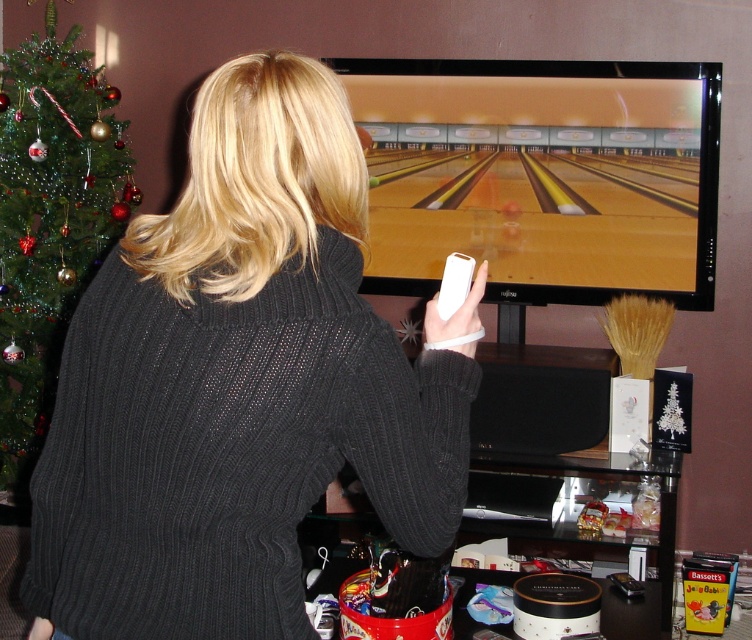
Question: Does black ribbed sweater at center appear over green textured christmas tree at left?

Choices:
 (A) yes
 (B) no

Answer: (B)

Question: Which of the following is the farthest from the observer?

Choices:
 (A) (240, 76)
 (B) (32, 97)

Answer: (B)

Question: Can you confirm if black ribbed sweater at center is wider than green textured christmas tree at left?

Choices:
 (A) no
 (B) yes

Answer: (B)

Question: Can you confirm if black ribbed sweater at center is bigger than green textured christmas tree at left?

Choices:
 (A) no
 (B) yes

Answer: (A)